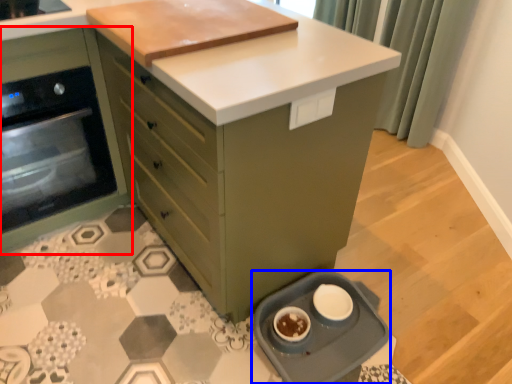
Question: Which object appears farthest to the camera in this image, cabinetry (highlighted by a red box) or kitchen appliance (highlighted by a blue box)?

Choices:
 (A) cabinetry
 (B) kitchen appliance

Answer: (A)